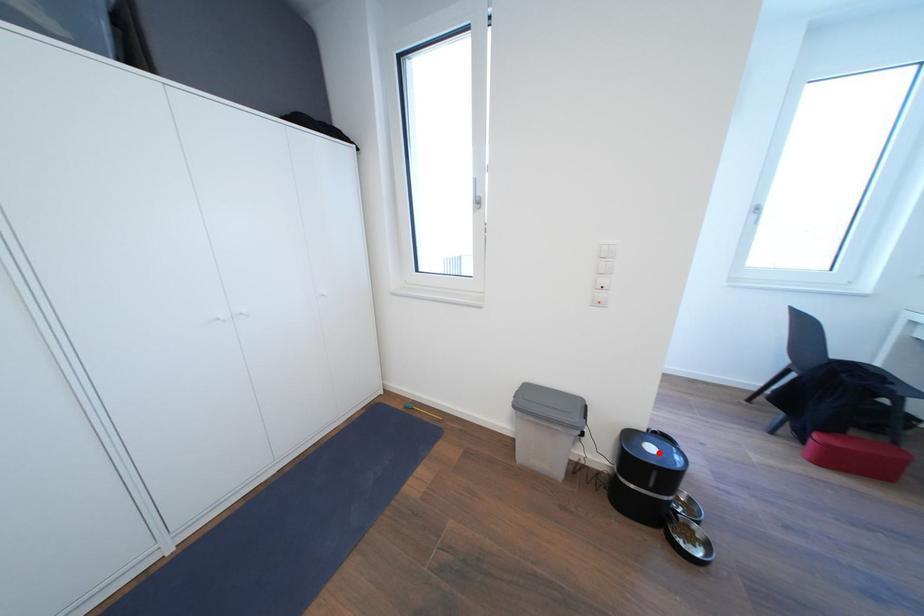
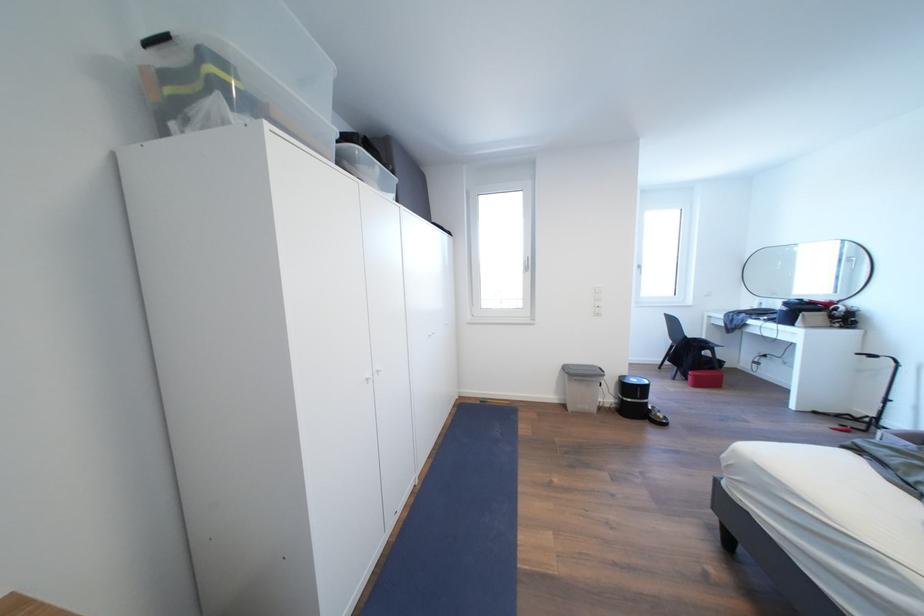
The point at the highlighted location is marked in the first image. Where is the corresponding point in the second image?

(641, 386)